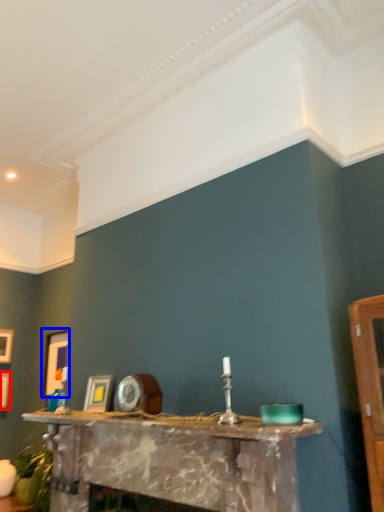
Question: Which of the following is the closest to the observer, picture frame (highlighted by a red box) or picture frame (highlighted by a blue box)?

Choices:
 (A) picture frame
 (B) picture frame

Answer: (B)